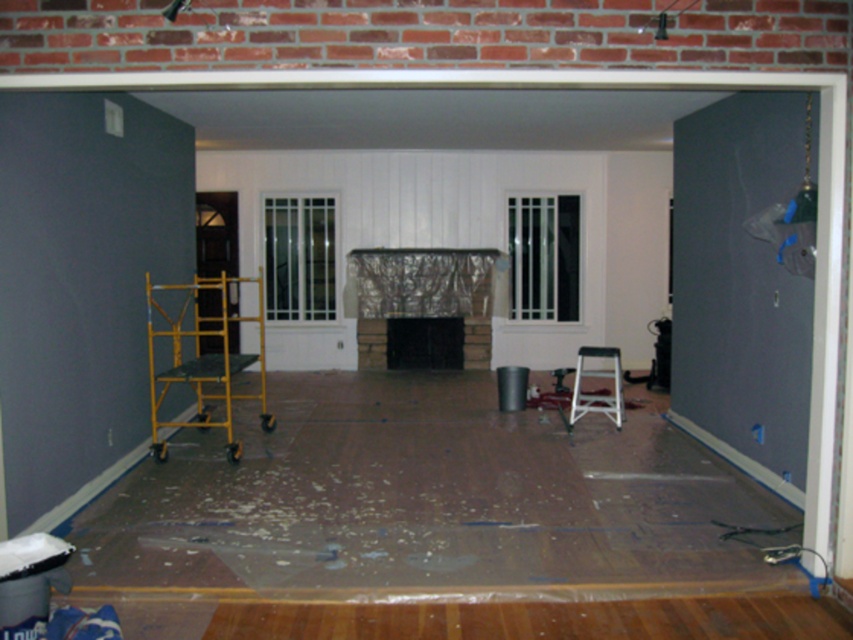
Can you confirm if matte gray door at right is positioned below white plastic stool at center?

Incorrect, matte gray door at right is not positioned below white plastic stool at center.

Where is `matte gray door at right`? This screenshot has height=640, width=853. matte gray door at right is located at coordinates (740, 289).

In order to click on matte gray door at right in this screenshot , I will do [x=740, y=289].

Between yellow metal scaffolding at left and white plastic stool at center, which one is positioned higher?

yellow metal scaffolding at left is higher up.

Describe the element at coordinates (204, 358) in the screenshot. The height and width of the screenshot is (640, 853). I see `yellow metal scaffolding at left` at that location.

This screenshot has width=853, height=640. Find the location of `yellow metal scaffolding at left`. yellow metal scaffolding at left is located at coordinates (204, 358).

Which of these two, matte gray door at right or yellow metal scaffolding at left, stands taller?

matte gray door at right

From the picture: Who is more distant from viewer, (784, 440) or (199, 284)?

The point (199, 284) is more distant.

Is point (679, 292) closer to camera compared to point (238, 451)?

No.

Find the location of a particular element. The width and height of the screenshot is (853, 640). matte gray door at right is located at coordinates (740, 289).